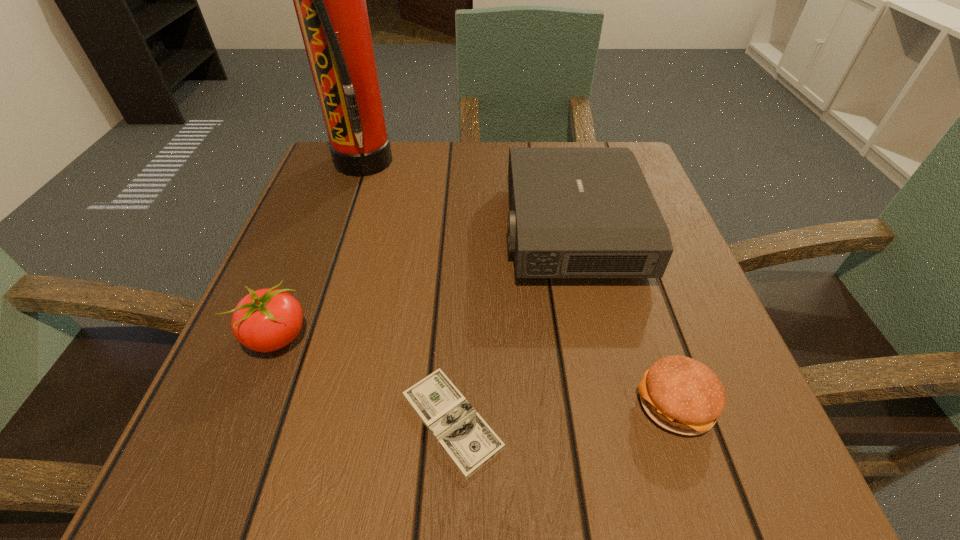
Where is `vacant point located 0.190m on the back of the tomato`? This screenshot has height=540, width=960. vacant point located 0.190m on the back of the tomato is located at coordinates (318, 235).

Where is `free space located 0.190m on the back of the hamburger`? The image size is (960, 540). free space located 0.190m on the back of the hamburger is located at coordinates (633, 276).

Where is `vacant space located 0.300m on the back of the dollar`? Image resolution: width=960 pixels, height=540 pixels. vacant space located 0.300m on the back of the dollar is located at coordinates (461, 235).

The width and height of the screenshot is (960, 540). I want to click on fire extinguisher present at the far edge, so click(330, 0).

The image size is (960, 540). What are the coordinates of `projector that is at the far edge` in the screenshot? It's located at (575, 212).

At what (x,y) coordinates should I click in order to perform the action: click on hamburger located in the near edge section of the desktop. Please return your answer as a coordinate pair (x, y). This screenshot has height=540, width=960. Looking at the image, I should click on (680, 394).

Find the location of `dollar at the near edge`. dollar at the near edge is located at coordinates (467, 439).

Identify the location of fire extinguisher located at the left edge. Image resolution: width=960 pixels, height=540 pixels. (330, 0).

The width and height of the screenshot is (960, 540). In order to click on tomato that is at the left edge in this screenshot , I will do `click(265, 320)`.

The width and height of the screenshot is (960, 540). What are the coordinates of `projector that is positioned at the right edge` in the screenshot? It's located at (575, 212).